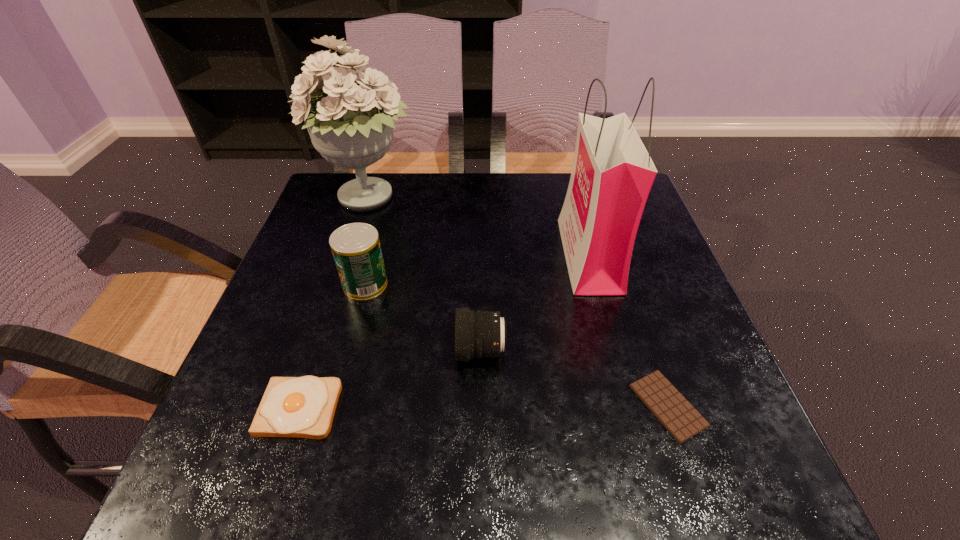
Locate an element on the screen. This screenshot has height=540, width=960. bouquet is located at coordinates (351, 126).

Locate an element on the screen. The height and width of the screenshot is (540, 960). shopping bag is located at coordinates (612, 174).

Locate an element on the screen. This screenshot has height=540, width=960. can is located at coordinates (356, 249).

This screenshot has height=540, width=960. In order to click on the fourth tallest object in this screenshot , I will do `click(478, 334)`.

Locate an element on the screen. telephoto lens is located at coordinates (478, 334).

Find the location of a particular element. toast is located at coordinates (304, 407).

At what (x,y) coordinates should I click in order to perform the action: click on the shortest object. Please return your answer as a coordinate pair (x, y). This screenshot has width=960, height=540. Looking at the image, I should click on (676, 414).

Locate an element on the screen. vacant position located on the right of the bouquet is located at coordinates (x=564, y=199).

Find the location of a particular element. Image resolution: width=960 pixels, height=540 pixels. vacant space located on the front-facing side of the shopping bag is located at coordinates (526, 255).

The width and height of the screenshot is (960, 540). I want to click on free space located on the front-facing side of the shopping bag, so click(510, 255).